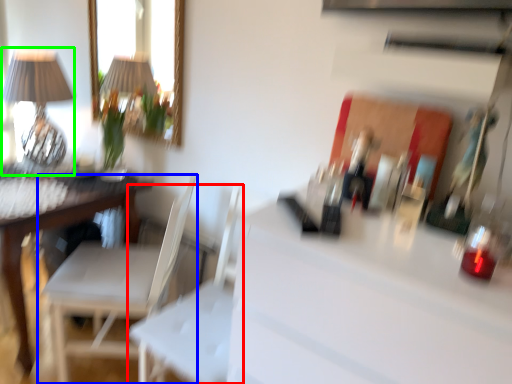
Question: Estimate the real-world distances between objects in this image. Which object is farther from swivel chair (highlighted by a red box), chair (highlighted by a blue box) or table lamp (highlighted by a green box)?

Choices:
 (A) chair
 (B) table lamp

Answer: (B)